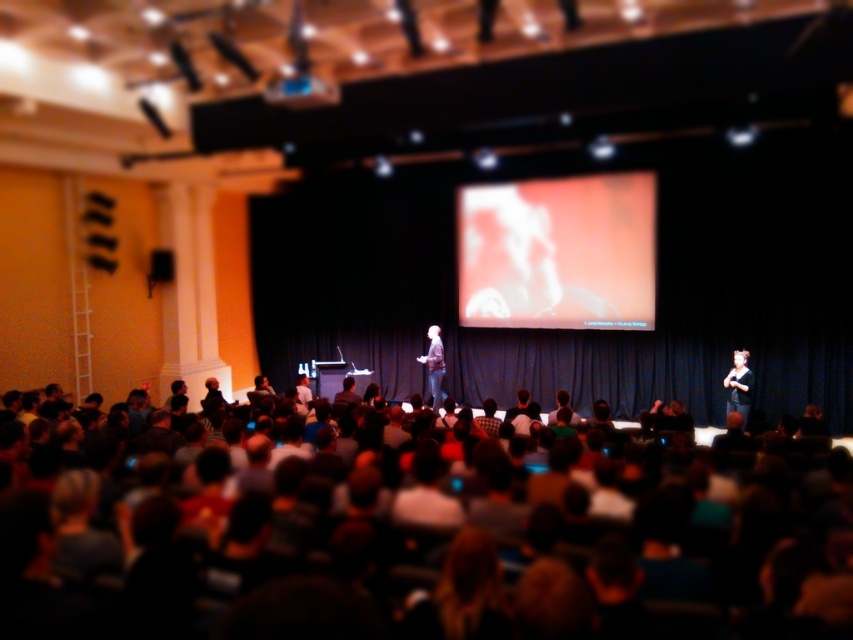
Question: Is blue plastic projector at upper center to the left of dark gray shirt at center from the viewer's perspective?

Choices:
 (A) yes
 (B) no

Answer: (A)

Question: Which point is closer to the camera?

Choices:
 (A) dark brown hair at lower center
 (B) dark gray jacket at center
 (C) dark gray shirt at center
 (D) blue plastic projector at upper center

Answer: (A)

Question: Which is nearer to the dark gray shirt at center?

Choices:
 (A) blue plastic projector at upper center
 (B) dark gray jacket at center
 (C) orange matte screen at center

Answer: (C)

Question: Can you confirm if dark brown hair at lower center is positioned below blue plastic projector at upper center?

Choices:
 (A) yes
 (B) no

Answer: (A)

Question: Which object is the farthest from the blue plastic projector at upper center?

Choices:
 (A) orange matte screen at center
 (B) dark gray shirt at center
 (C) dark brown hair at lower center

Answer: (B)

Question: Does dark brown hair at lower center have a larger size compared to dark gray jacket at center?

Choices:
 (A) yes
 (B) no

Answer: (A)